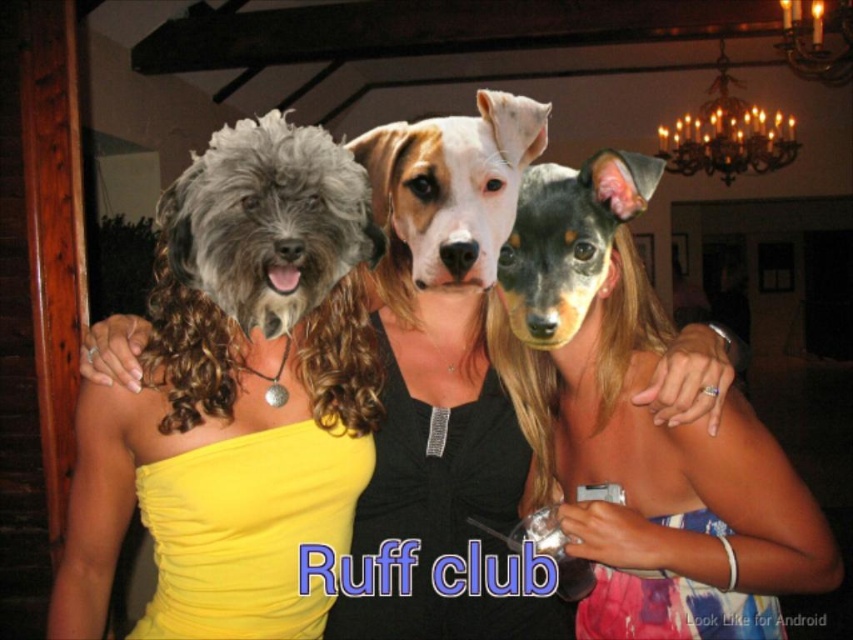
Question: Which of the following is the closest to the observer?

Choices:
 (A) (506, 333)
 (B) (619, 152)
 (C) (263, 161)

Answer: (C)

Question: Considering the real-world distances, which object is closest to the matte black dress at center?

Choices:
 (A) yellow satin dress at left
 (B) yellow satin dress at center

Answer: (B)

Question: Which object is farther from the camera taking this photo?

Choices:
 (A) black and tan fur at center
 (B) yellow satin dress at center
 (C) matte black dress at center
 (D) yellow satin dress at left

Answer: (B)

Question: Does matte black dress at center have a lesser width compared to black and tan fur at center?

Choices:
 (A) yes
 (B) no

Answer: (B)

Question: Does white fur dog at center appear under black and tan fur at center?

Choices:
 (A) yes
 (B) no

Answer: (B)

Question: Does yellow satin dress at left appear on the right side of fuzzy gray dog at left?

Choices:
 (A) yes
 (B) no

Answer: (A)